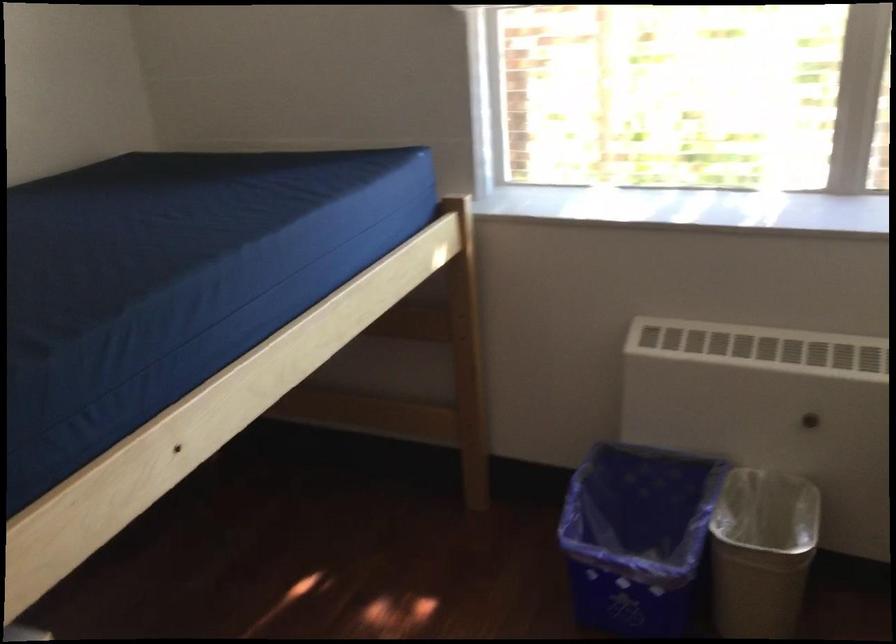
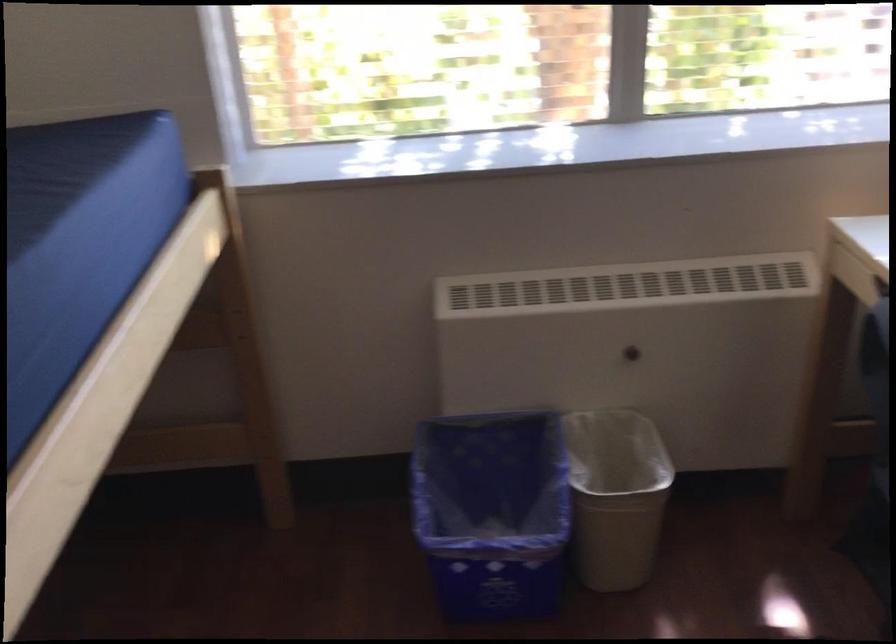
Which direction would the cameraman need to move to produce the second image?

The cameraman walked toward left, forward.